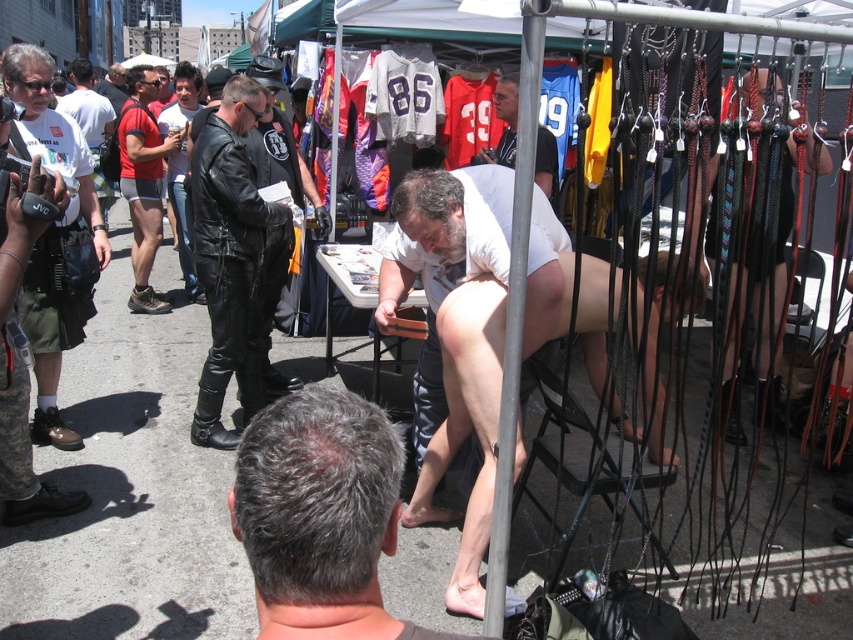
Which is above, white matte shorts at center or matte red shorts at left?

matte red shorts at left is higher up.

Is white matte shorts at center closer to the viewer compared to matte red shorts at left?

That is True.

You are a GUI agent. You are given a task and a screenshot of the screen. Output one action in this format:
    pyautogui.click(x=<x>, y=<y>)
    Task: Click on the white matte shorts at center
    This screenshot has width=853, height=640.
    Given the screenshot: What is the action you would take?
    pyautogui.click(x=442, y=268)

Between black leather pants at center and white jersey at upper center, which one has less height?

Standing shorter between the two is white jersey at upper center.

Does black leather pants at center come behind white jersey at upper center?

No, black leather pants at center is closer to the viewer.

At what (x,y) coordinates should I click in order to perform the action: click on black leather pants at center. Please return your answer as a coordinate pair (x, y). Looking at the image, I should click on (229, 256).

Can you confirm if gray hair at center is bigger than white matte shorts at center?

No, gray hair at center is not bigger than white matte shorts at center.

Consider the image. Who is more distant from viewer, (376, 540) or (445, 381)?

Point (445, 381)

Where is `gray hair at center`? The width and height of the screenshot is (853, 640). gray hair at center is located at coordinates (320, 516).